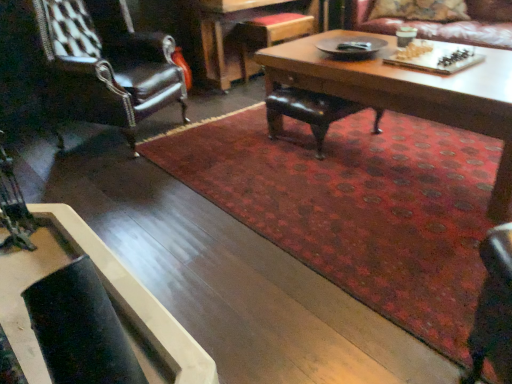
Question: Is matte black coffee table at center, the 1th coffee table in the bottom-to-top sequence, taller than matte brown cup at upper right?

Choices:
 (A) no
 (B) yes

Answer: (B)

Question: Is matte black coffee table at center, the 1th coffee table in the bottom-to-top sequence, positioned beyond the bounds of matte brown cup at upper right?

Choices:
 (A) no
 (B) yes

Answer: (B)

Question: Considering the relative sizes of matte black coffee table at center, which is the second coffee table in back-to-front order, and matte brown cup at upper right in the image provided, is matte black coffee table at center, which is the second coffee table in back-to-front order, bigger than matte brown cup at upper right?

Choices:
 (A) no
 (B) yes

Answer: (B)

Question: Can you confirm if matte black coffee table at center, the 1th coffee table in the bottom-to-top sequence, is shorter than matte brown cup at upper right?

Choices:
 (A) no
 (B) yes

Answer: (A)

Question: From the image's perspective, would you say matte black coffee table at center, which is counted as the 1th coffee table, starting from the left, is shown under matte brown cup at upper right?

Choices:
 (A) no
 (B) yes

Answer: (B)

Question: Would you consider matte black coffee table at center, the 2th coffee table when ordered from right to left, to be distant from matte brown cup at upper right?

Choices:
 (A) yes
 (B) no

Answer: (A)

Question: Is matte black coffee table at center, the 2th coffee table when ordered from right to left, to the right of velvet floral pillow at upper right from the viewer's perspective?

Choices:
 (A) no
 (B) yes

Answer: (A)

Question: Does matte black coffee table at center, the 1th coffee table in the bottom-to-top sequence, have a smaller size compared to velvet floral pillow at upper right?

Choices:
 (A) no
 (B) yes

Answer: (B)

Question: Would you consider matte black coffee table at center, which appears as the 1th coffee table when viewed from the front, to be distant from velvet floral pillow at upper right?

Choices:
 (A) no
 (B) yes

Answer: (B)

Question: From a real-world perspective, is matte black coffee table at center, which appears as the 1th coffee table when viewed from the front, physically above velvet floral pillow at upper right?

Choices:
 (A) no
 (B) yes

Answer: (A)

Question: Considering the relative sizes of matte black coffee table at center, the 1th coffee table in the bottom-to-top sequence, and velvet floral pillow at upper right in the image provided, is matte black coffee table at center, the 1th coffee table in the bottom-to-top sequence, bigger than velvet floral pillow at upper right?

Choices:
 (A) yes
 (B) no

Answer: (B)

Question: From a real-world perspective, is matte black coffee table at center, which is counted as the 2th coffee table, starting from the top, positioned under velvet floral pillow at upper right based on gravity?

Choices:
 (A) no
 (B) yes

Answer: (B)

Question: Is velvet floral pillow at upper right surrounding leather armchair at left, acting as the second chair starting from the right?

Choices:
 (A) no
 (B) yes

Answer: (A)